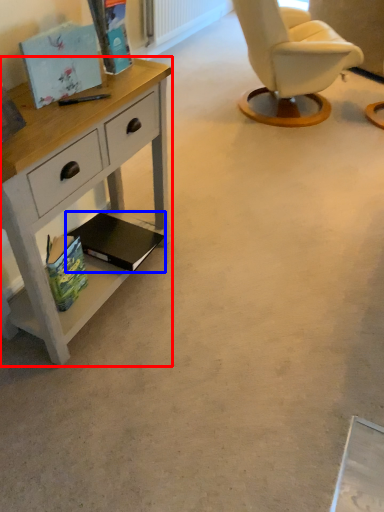
Question: Among these objects, which one is nearest to the camera, desk (highlighted by a red box) or magazine (highlighted by a blue box)?

Choices:
 (A) desk
 (B) magazine

Answer: (A)